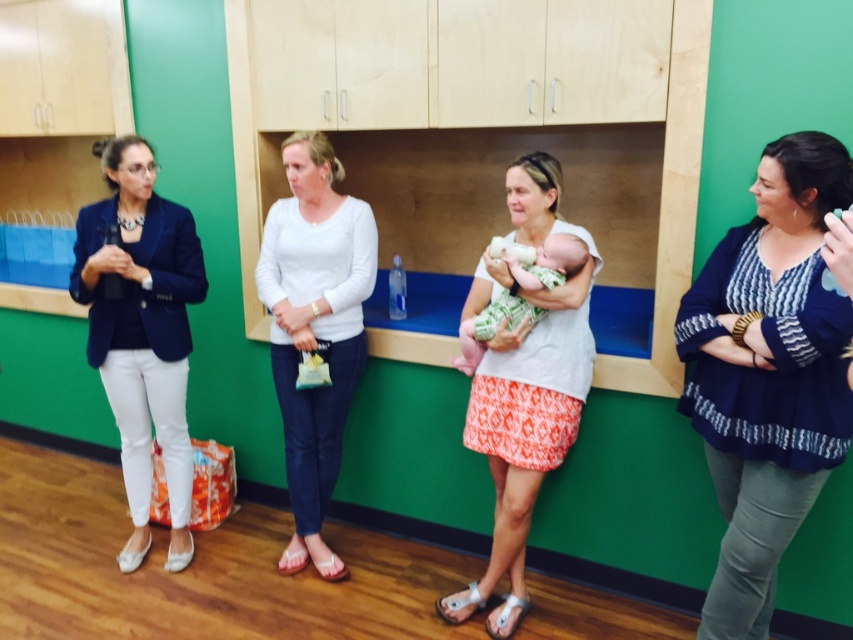
Question: Does matte black blazer at left have a lesser width compared to green textured blanket at center?

Choices:
 (A) yes
 (B) no

Answer: (B)

Question: Does blue striped blouse at right lie in front of green textured blanket at center?

Choices:
 (A) yes
 (B) no

Answer: (A)

Question: Which of these objects is positioned closest to the white matte sweater at center?

Choices:
 (A) green textured blanket at center
 (B) blue striped blouse at right
 (C) matte black blazer at left

Answer: (C)

Question: Does matte black blazer at left have a lesser width compared to white cotton shirt at center?

Choices:
 (A) no
 (B) yes

Answer: (B)

Question: Which of the following is the closest to the observer?

Choices:
 (A) (845, 444)
 (B) (280, 260)
 (C) (161, 429)
 (D) (585, 288)

Answer: (A)

Question: Which is nearer to the white cotton shirt at center?

Choices:
 (A) matte black blazer at left
 (B) green textured blanket at center
 (C) blue striped blouse at right
 (D) white matte sweater at center

Answer: (B)